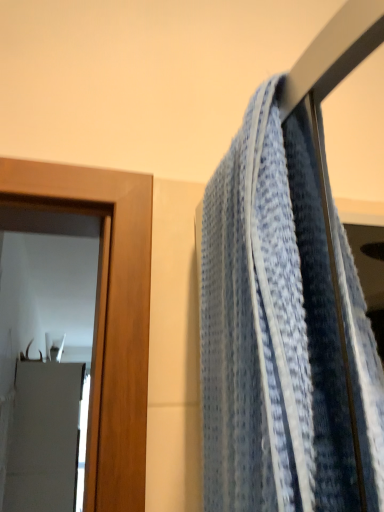
Where is `blue textured fabric at right`? The height and width of the screenshot is (512, 384). blue textured fabric at right is located at coordinates (271, 328).

What do you see at coordinates (271, 328) in the screenshot? The width and height of the screenshot is (384, 512). I see `blue textured fabric at right` at bounding box center [271, 328].

Identify the location of blue textured fabric at right. The width and height of the screenshot is (384, 512). (271, 328).